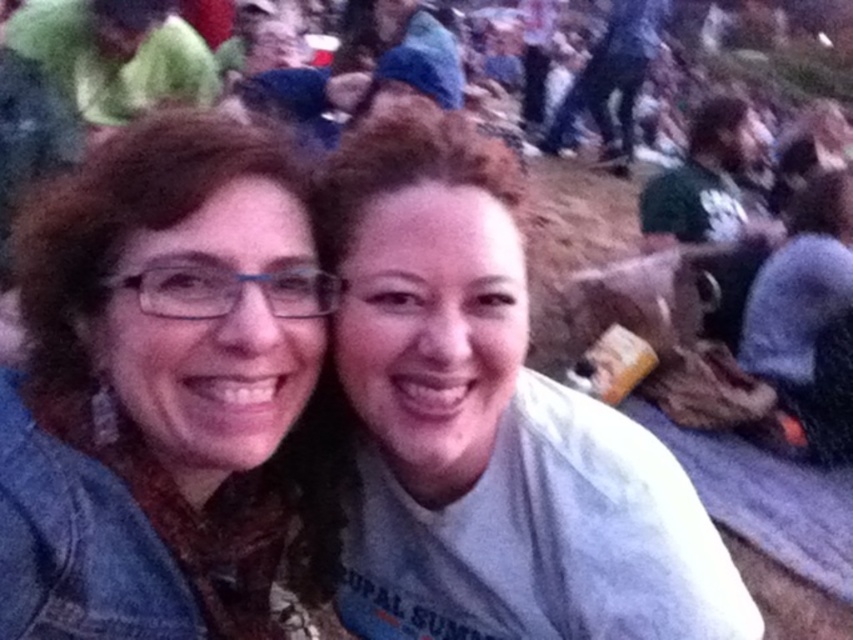
Describe the element at coordinates (160, 387) in the screenshot. Image resolution: width=853 pixels, height=640 pixels. I see `matte blue jacket at left` at that location.

Does matte blue jacket at left have a lesser width compared to green fabric at upper left?

Indeed, matte blue jacket at left has a lesser width compared to green fabric at upper left.

Find the location of `matte blue jacket at left`. matte blue jacket at left is located at coordinates (x=160, y=387).

Can you confirm if matte blue jacket at left is positioned to the right of gray cotton shirt at center?

In fact, matte blue jacket at left is to the left of gray cotton shirt at center.

Is point (22, 400) farther from viewer compared to point (386, 320)?

No.

Where is `matte blue jacket at left`? matte blue jacket at left is located at coordinates [x=160, y=387].

Between point (421, 276) and point (207, 45), which one is positioned behind?

Point (207, 45)

Is gray cotton shirt at center to the left of green fabric at upper left from the viewer's perspective?

Incorrect, gray cotton shirt at center is not on the left side of green fabric at upper left.

Is point (648, 637) in front of point (106, 6)?

Yes, point (648, 637) is in front of point (106, 6).

At what (x,y) coordinates should I click in order to perform the action: click on gray cotton shirt at center. Please return your answer as a coordinate pair (x, y). This screenshot has width=853, height=640. Looking at the image, I should click on (488, 424).